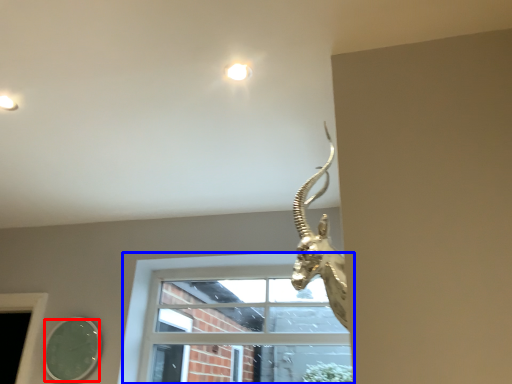
Question: Which of the following is the farthest to the observer, mirror (highlighted by a red box) or window (highlighted by a blue box)?

Choices:
 (A) mirror
 (B) window

Answer: (A)